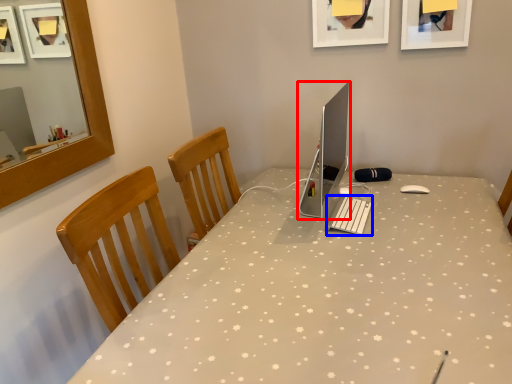
Question: Which point is closer to the camera, computer monitor (highlighted by a red box) or laptop keyboard (highlighted by a blue box)?

Choices:
 (A) computer monitor
 (B) laptop keyboard

Answer: (A)